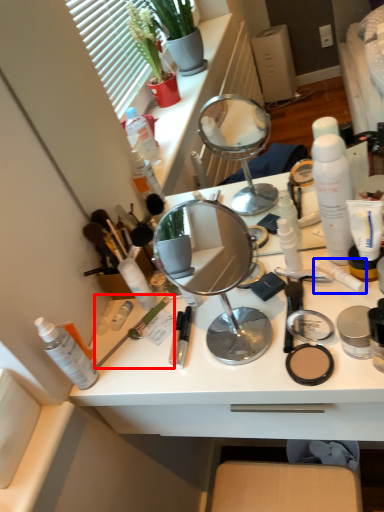
Question: Which of the following is the closest to the observer, brush (highlighted by a red box) or toothpaste (highlighted by a blue box)?

Choices:
 (A) brush
 (B) toothpaste

Answer: (B)